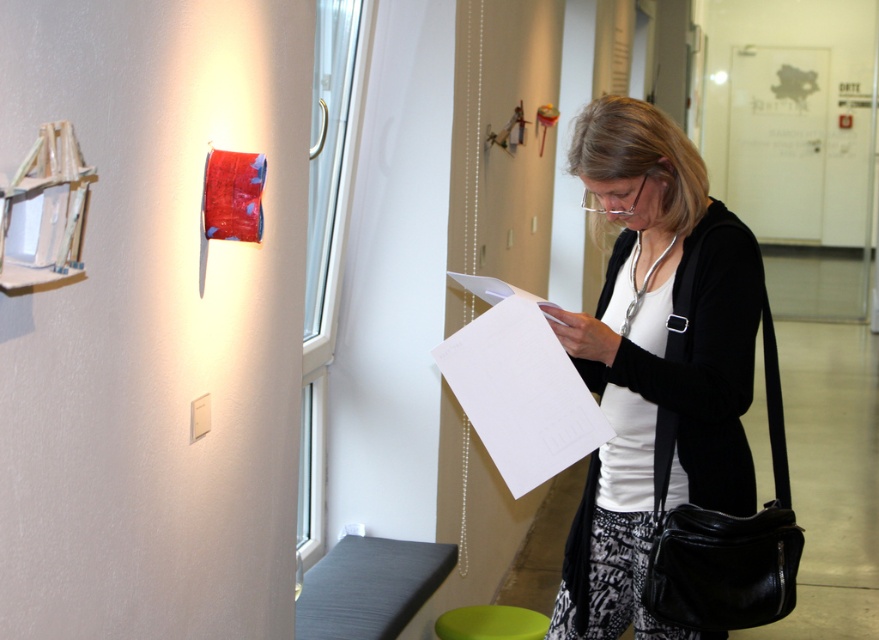
Between white matte paper at center and green fabric stool at lower center, which one has less height?

With less height is green fabric stool at lower center.

Who is positioned more to the right, white matte paper at center or green fabric stool at lower center?

white matte paper at center is more to the right.

Locate an element on the screen. white matte paper at center is located at coordinates (658, 364).

Which is more to the left, white paper at center or green fabric stool at lower center?

green fabric stool at lower center

Locate an element on the screen. Image resolution: width=879 pixels, height=640 pixels. white paper at center is located at coordinates (519, 387).

Find the location of a particular element. The width and height of the screenshot is (879, 640). white paper at center is located at coordinates (519, 387).

Can you confirm if white matte paper at center is positioned to the left of white paper at center?

No, white matte paper at center is not to the left of white paper at center.

I want to click on white matte paper at center, so click(x=658, y=364).